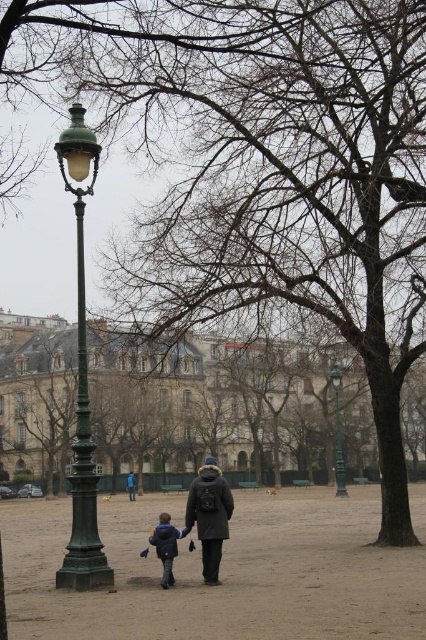
You are a photographer setting up equipment in the park. You need to position a camera tripod between the green metal lamp post at center and the blue fabric jacket at center. Which object should you place the tripod closer to to ensure it fits within the available space?

The blue fabric jacket at center is narrower than the green metal lamp post at center, so placing the tripod closer to the blue fabric jacket at center would allow it to fit better within the available space.

You are a photographer trying to capture a clear photo of the green metal lamp post at center without the blue fabric jacket at center blocking it. Based on their positions, is this possible?

The green metal lamp post at center is in front of the blue fabric jacket at center, so it is blocking the view of the jacket. Therefore, you can take a clear photo of the green metal lamp post at center without the blue fabric jacket at center in the frame.